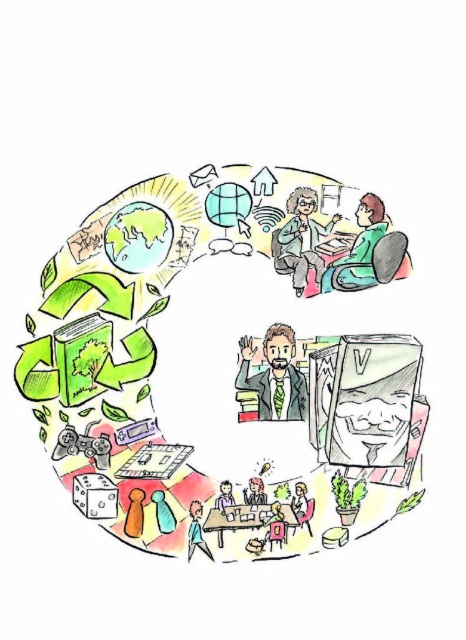
Question: Which of the following is the farthest from the observer?

Choices:
 (A) green fabric jacket at upper right
 (B) smooth wooden desk at center

Answer: (A)

Question: Can you confirm if brown textured suit at center is thinner than green fabric jacket at upper right?

Choices:
 (A) yes
 (B) no

Answer: (A)

Question: Among these objects, which one is nearest to the camera?

Choices:
 (A) smooth wooden desk at center
 (B) brown textured suit at center
 (C) green fabric jacket at upper right

Answer: (A)

Question: Does brown textured suit at center come in front of green fabric jacket at upper right?

Choices:
 (A) yes
 (B) no

Answer: (B)

Question: Which point is farther from the camera taking this photo?

Choices:
 (A) (300, 404)
 (B) (361, 401)

Answer: (A)

Question: Is brown textured suit at center to the left of green fabric jacket at upper right from the viewer's perspective?

Choices:
 (A) yes
 (B) no

Answer: (A)